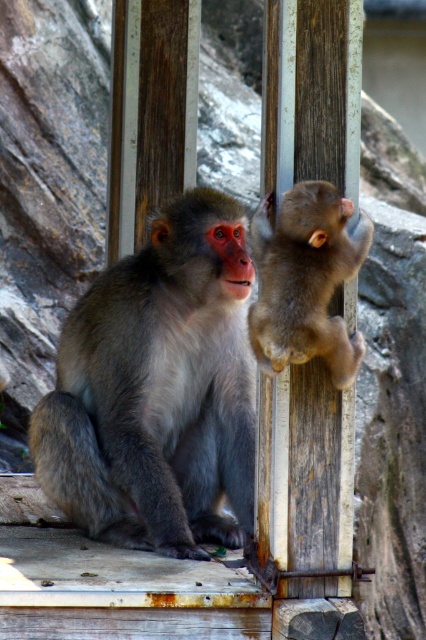
You are a wildlife photographer aiming to capture a closeup of the gray fur monkey at center and the brown furry monkey at upper right. Based on their positions, which monkey would appear larger in your photo?

The gray fur monkey at center would appear larger in the photo because it is closer to the viewer compared to the brown furry monkey at upper right.

You are a photographer taking a picture of the two monkeys. You notice two points in the scene at coordinates point (172,292) and point (324,259). Which point is closer to your camera lens?

Point (324,259) is closer to the camera lens because it is less further than point (172,292).